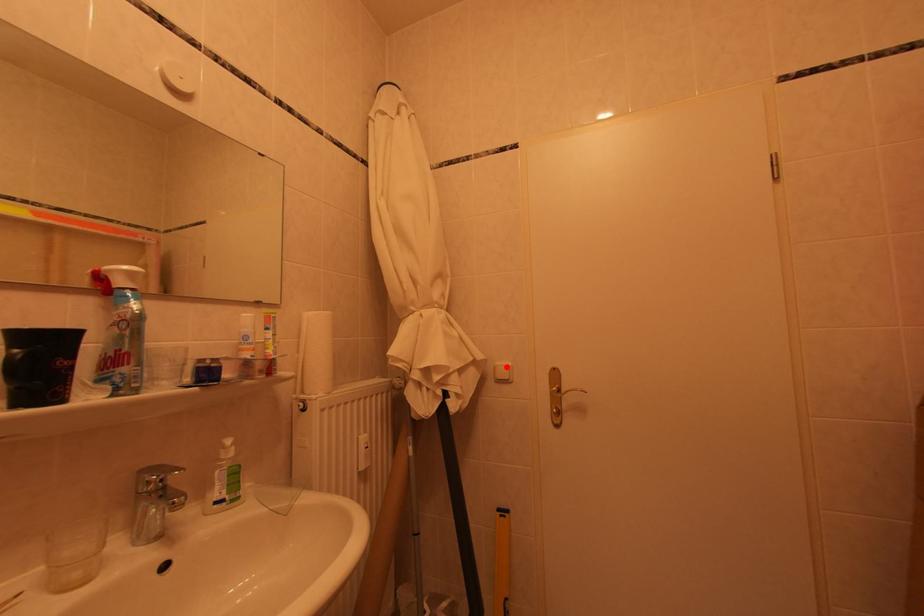
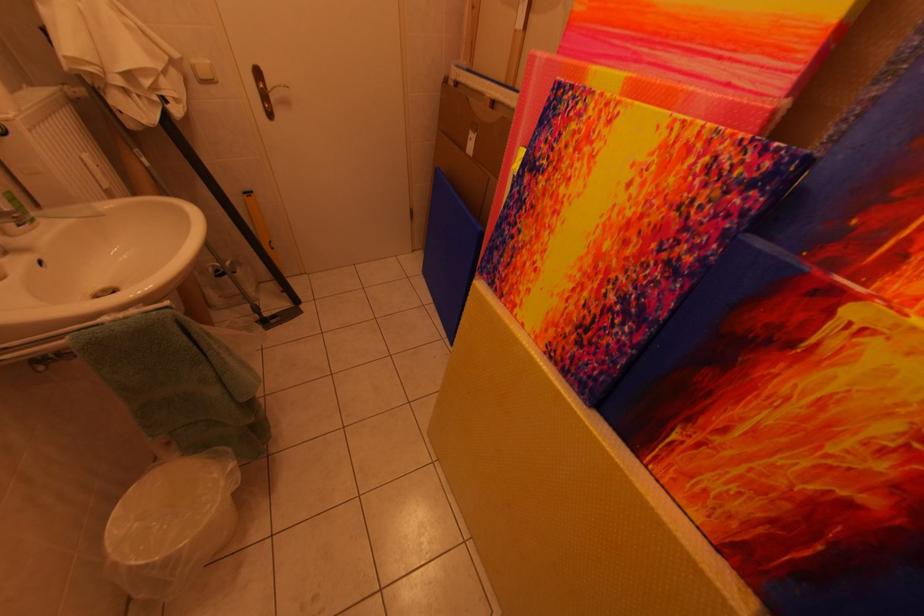
Locate, in the second image, the point that corresponds to the highlighted location in the first image.

(203, 65)